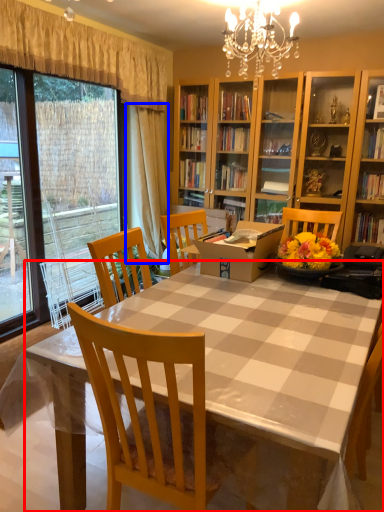
Question: Which of the following is the closest to the observer, desk (highlighted by a red box) or curtain (highlighted by a blue box)?

Choices:
 (A) desk
 (B) curtain

Answer: (A)